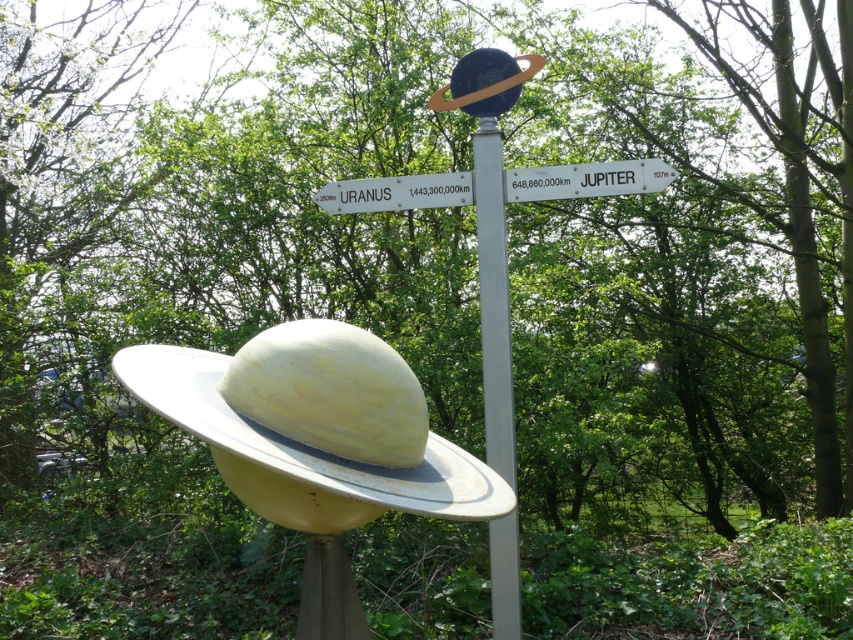
You are standing at the signpost in the image and want to walk towards the point that is closer to you. Which point should you choose, point (503,609) or point (473,192)?

Point (503,609) is in front of point (473,192), so you should choose point (503,609) as it is closer to you.